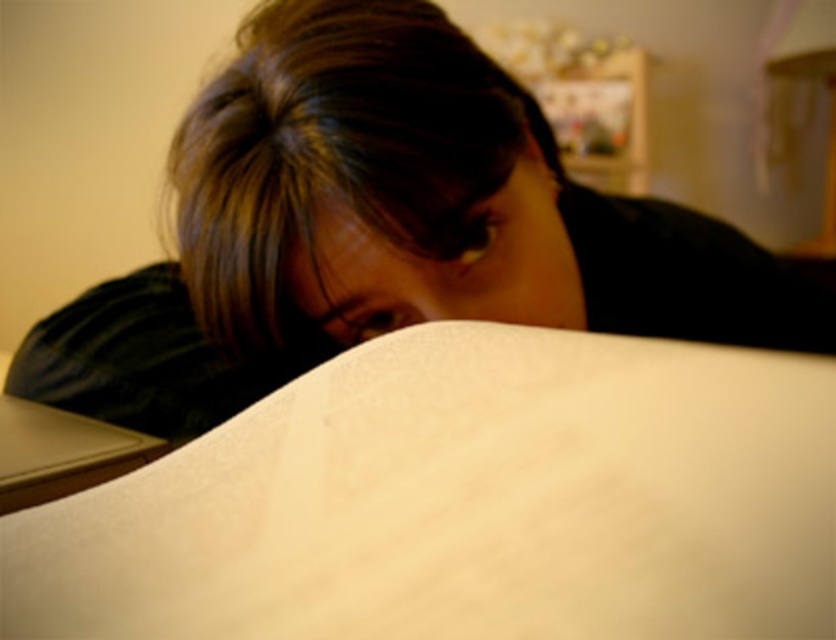
Between matte black hair at upper center and black matte laptop at lower left, which one appears on the right side from the viewer's perspective?

From the viewer's perspective, matte black hair at upper center appears more on the right side.

Does matte black hair at upper center have a greater width compared to black matte laptop at lower left?

Yes.

This screenshot has width=836, height=640. Describe the element at coordinates (371, 221) in the screenshot. I see `matte black hair at upper center` at that location.

This screenshot has width=836, height=640. I want to click on matte black hair at upper center, so click(x=371, y=221).

Which of these two, white matte blanket at lower center or matte black hair at upper center, stands shorter?

white matte blanket at lower center

Between point (404, 365) and point (19, 365), which one is positioned behind?

The point (19, 365) is more distant.

Between point (778, 628) and point (146, 332), which one is positioned in front?

Point (778, 628) is more forward.

Find the location of `white matte blanket at lower center`. white matte blanket at lower center is located at coordinates (465, 502).

Who is shorter, white matte blanket at lower center or black matte laptop at lower left?

black matte laptop at lower left

What do you see at coordinates (465, 502) in the screenshot?
I see `white matte blanket at lower center` at bounding box center [465, 502].

Identify the location of white matte blanket at lower center. point(465,502).